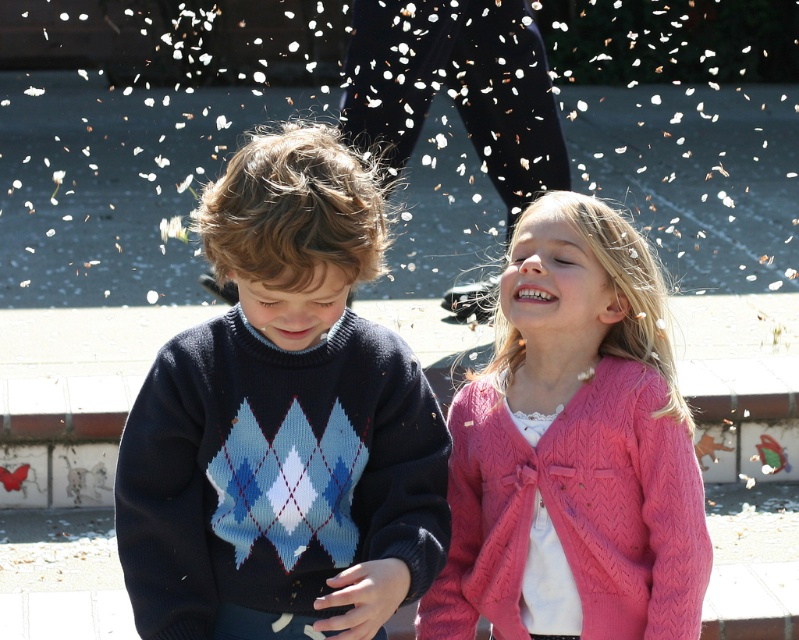
Question: Can you confirm if white paper at center is bigger than knitted sweater at center?

Choices:
 (A) yes
 (B) no

Answer: (A)

Question: Is knitted sweater at center smaller than pink knitted cardigan at upper right?

Choices:
 (A) no
 (B) yes

Answer: (A)

Question: Which is nearer to the pink knitted cardigan at upper right?

Choices:
 (A) knitted sweater at center
 (B) white paper at center

Answer: (A)

Question: Which of these objects is positioned closest to the white paper at center?

Choices:
 (A) pink knitted cardigan at upper right
 (B) knitted sweater at center

Answer: (A)

Question: Estimate the real-world distances between objects in this image. Which object is farther from the knitted sweater at center?

Choices:
 (A) pink knitted cardigan at upper right
 (B) white paper at center

Answer: (B)

Question: Is white paper at center below knitted sweater at center?

Choices:
 (A) no
 (B) yes

Answer: (A)